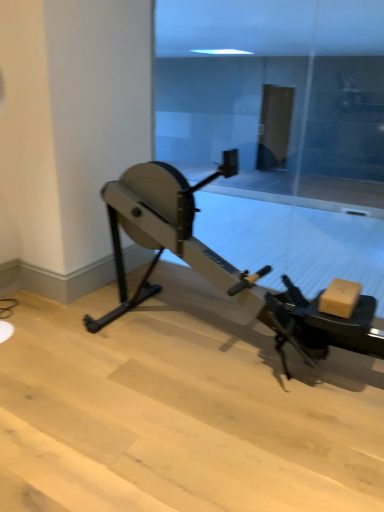
Question: From the image's perspective, is metallic gray stationary bicycle at center under transparent glass door at center?

Choices:
 (A) no
 (B) yes

Answer: (B)

Question: From a real-world perspective, is metallic gray stationary bicycle at center positioned under transparent glass door at center based on gravity?

Choices:
 (A) no
 (B) yes

Answer: (B)

Question: Is metallic gray stationary bicycle at center to the right of transparent glass door at center from the viewer's perspective?

Choices:
 (A) no
 (B) yes

Answer: (A)

Question: Is metallic gray stationary bicycle at center positioned with its back to transparent glass door at center?

Choices:
 (A) yes
 (B) no

Answer: (A)

Question: From the image's perspective, is metallic gray stationary bicycle at center on transparent glass door at center?

Choices:
 (A) no
 (B) yes

Answer: (A)

Question: Are metallic gray stationary bicycle at center and transparent glass door at center making contact?

Choices:
 (A) yes
 (B) no

Answer: (B)

Question: Can you confirm if transparent glass door at center is bigger than metallic gray stationary bicycle at center?

Choices:
 (A) no
 (B) yes

Answer: (A)

Question: Are transparent glass door at center and metallic gray stationary bicycle at center far apart?

Choices:
 (A) no
 (B) yes

Answer: (B)

Question: Is metallic gray stationary bicycle at center at the back of transparent glass door at center?

Choices:
 (A) yes
 (B) no

Answer: (A)

Question: Considering the relative sizes of transparent glass door at center and metallic gray stationary bicycle at center in the image provided, is transparent glass door at center thinner than metallic gray stationary bicycle at center?

Choices:
 (A) yes
 (B) no

Answer: (A)

Question: From a real-world perspective, is transparent glass door at center below metallic gray stationary bicycle at center?

Choices:
 (A) no
 (B) yes

Answer: (A)

Question: Could you tell me if transparent glass door at center is turned towards metallic gray stationary bicycle at center?

Choices:
 (A) no
 (B) yes

Answer: (B)

Question: Is metallic gray stationary bicycle at center wider or thinner than transparent glass door at center?

Choices:
 (A) wide
 (B) thin

Answer: (A)